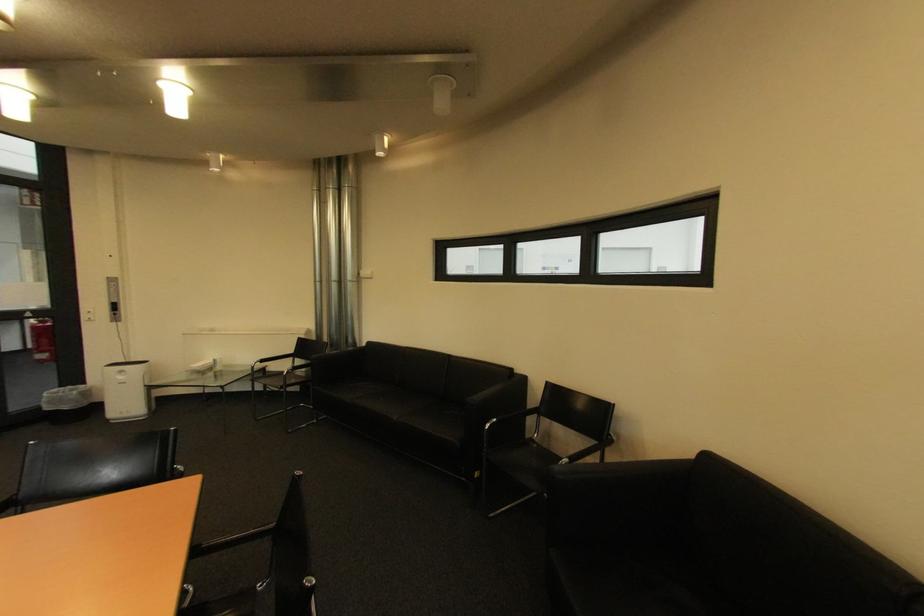
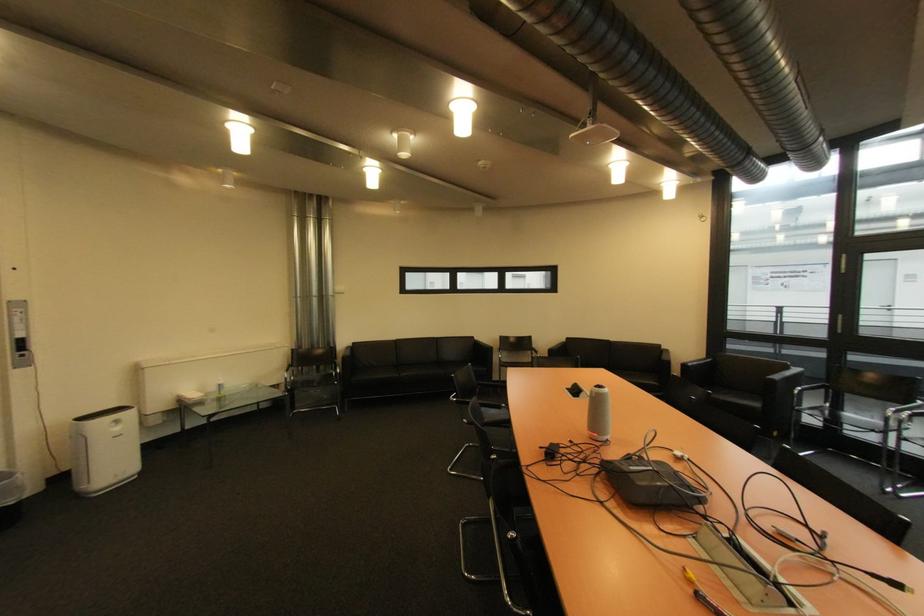
The point at (124,315) is marked in the first image. Where is the corresponding point in the second image?

(30, 357)